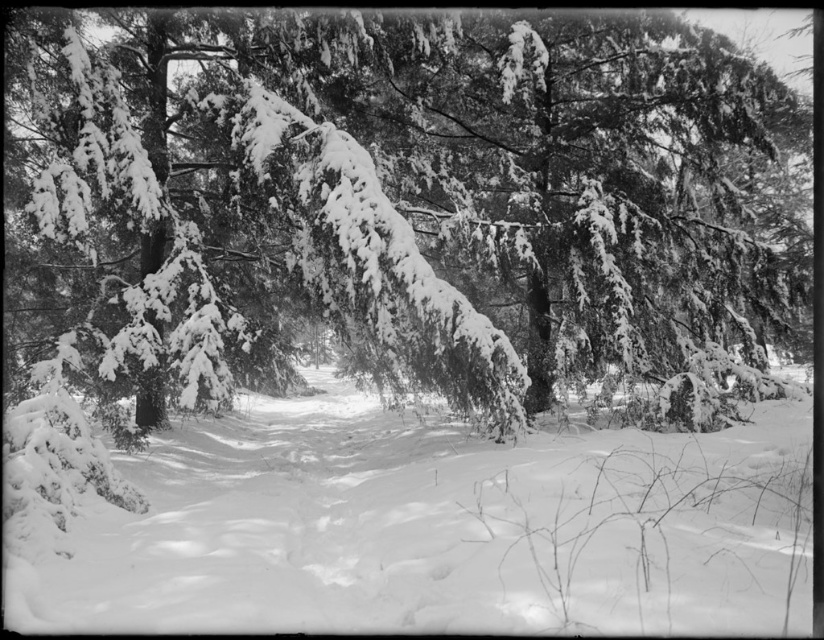
Is snow-covered evergreen at center wider than white fluffy snow at center?

Yes.

From the picture: Is snow-covered evergreen at center positioned behind white fluffy snow at center?

Yes, snow-covered evergreen at center is behind white fluffy snow at center.

Describe the element at coordinates (396, 195) in the screenshot. Image resolution: width=824 pixels, height=640 pixels. I see `snow-covered evergreen at center` at that location.

The width and height of the screenshot is (824, 640). What are the coordinates of `snow-covered evergreen at center` in the screenshot? It's located at (396, 195).